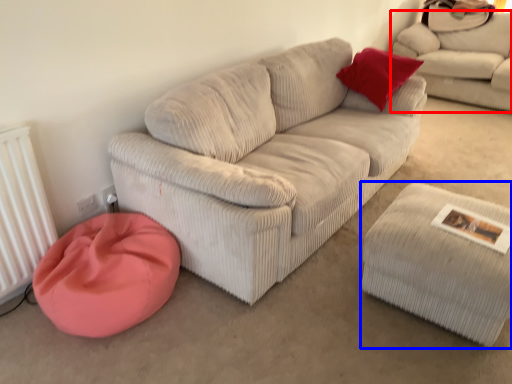
Question: Which point is closer to the camera, studio couch (highlighted by a red box) or stool (highlighted by a blue box)?

Choices:
 (A) studio couch
 (B) stool

Answer: (B)